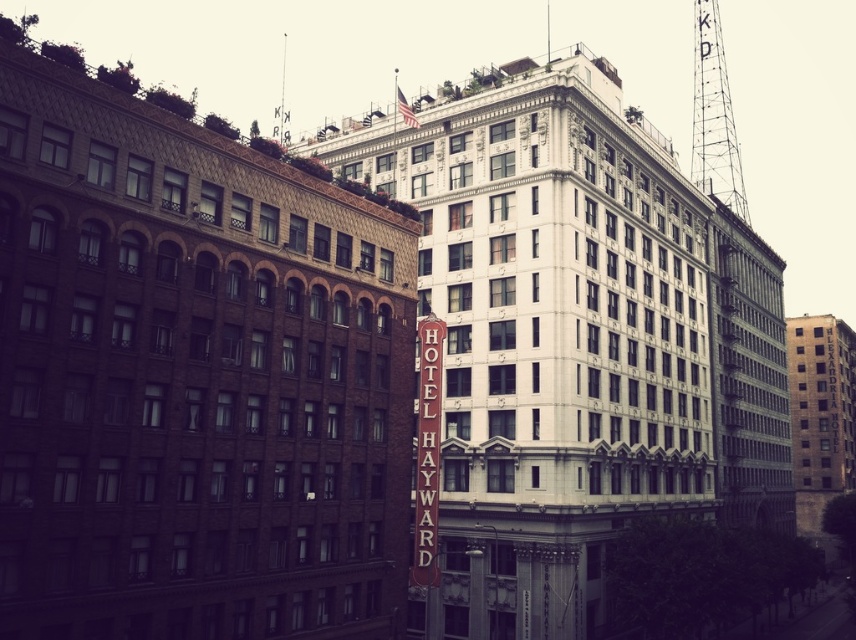
Question: Observing the image, what is the correct spatial positioning of metallic tower at upper right in reference to brown wooden sign at center?

Choices:
 (A) left
 (B) right

Answer: (B)

Question: Can you confirm if brown stone building at right is wider than brown wooden sign at center?

Choices:
 (A) no
 (B) yes

Answer: (B)

Question: Is metallic tower at upper right below brown wooden sign at center?

Choices:
 (A) no
 (B) yes

Answer: (A)

Question: Which object is farther from the camera taking this photo?

Choices:
 (A) brown stone building at right
 (B) brown wooden sign at center
 (C) metallic tower at upper right

Answer: (A)

Question: Among these points, which one is nearest to the camera?

Choices:
 (A) (729, 93)
 (B) (429, 536)
 (C) (794, 456)

Answer: (B)

Question: Estimate the real-world distances between objects in this image. Which object is closer to the brown stone building at right?

Choices:
 (A) metallic tower at upper right
 (B) brown wooden sign at center

Answer: (A)